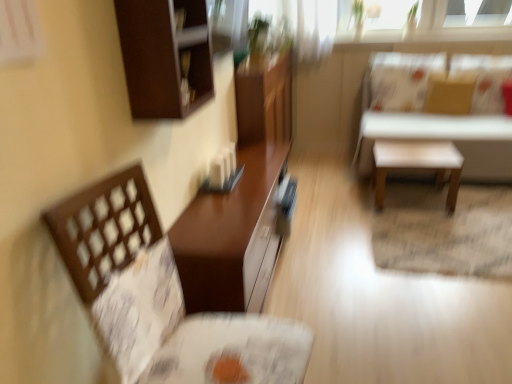
What is the approximate width of white matte stool at upper right, which is the second table from front to back?

white matte stool at upper right, which is the second table from front to back, is 38.55 inches in width.

This screenshot has height=384, width=512. Describe the element at coordinates (445, 139) in the screenshot. I see `white matte stool at upper right, acting as the second table starting from the left` at that location.

Measure the distance between matte brown table at center, placed as the second table when sorted from right to left, and camera.

They are 1.54 meters apart.

Locate an element on the screen. This screenshot has height=384, width=512. brown woven chair at left is located at coordinates (118, 263).

Image resolution: width=512 pixels, height=384 pixels. In order to click on dark brown wood cabinet at upper left in this screenshot , I will do `click(166, 56)`.

Where is `white matte stool at upper right, acting as the second table starting from the left`? This screenshot has height=384, width=512. white matte stool at upper right, acting as the second table starting from the left is located at coordinates (445, 139).

From the image's perspective, which one is positioned lower, brown woven chair at left or white matte stool at upper right, which is the second table from front to back?

brown woven chair at left, from the image's perspective.

At what (x,y) coordinates should I click in order to perform the action: click on chair that appears in front of the white matte stool at upper right, which is the 1th table in right-to-left order. Please return your answer as a coordinate pair (x, y). This screenshot has height=384, width=512. Looking at the image, I should click on (118, 263).

Could you tell me if brown woven chair at left is facing white matte stool at upper right, which is the second table from front to back?

No, brown woven chair at left is not aimed at white matte stool at upper right, which is the second table from front to back.

From a real-world perspective, is white matte stool at center positioned over brown woven chair at left based on gravity?

No.

Which object is further away from the camera, white matte stool at center or brown woven chair at left?

white matte stool at center is behind.

The width and height of the screenshot is (512, 384). In order to click on chair that appears above the white matte stool at center (from a real-world perspective) in this screenshot , I will do `click(118, 263)`.

Which is behind, white matte stool at upper right, which is the 1th table in right-to-left order, or matte brown table at center, the 2th table positioned from the back?

Positioned behind is white matte stool at upper right, which is the 1th table in right-to-left order.

Is white matte stool at upper right, which is the 1th table in right-to-left order, bigger or smaller than matte brown table at center, arranged as the first table when viewed from the front?

Clearly, white matte stool at upper right, which is the 1th table in right-to-left order, is larger in size than matte brown table at center, arranged as the first table when viewed from the front.

From a real-world perspective, between white matte stool at upper right, which is the 1th table in right-to-left order, and matte brown table at center, the 2th table positioned from the back, who is vertically lower?

matte brown table at center, the 2th table positioned from the back, from a real-world perspective.

From the image's perspective, is white matte stool at upper right, which is the 1th table in right-to-left order, located above or below matte brown table at center, which is the first table from left to right?

From the image's perspective, white matte stool at upper right, which is the 1th table in right-to-left order, appears above matte brown table at center, which is the first table from left to right.

Is point (450, 132) closer to camera compared to point (440, 143)?

No, it is behind (440, 143).

Considering the positions of objects white matte stool at upper right, the first table positioned from the back, and white matte stool at center in the image provided, who is behind, white matte stool at upper right, the first table positioned from the back, or white matte stool at center?

Positioned behind is white matte stool at upper right, the first table positioned from the back.

Considering the relative sizes of white matte stool at upper right, the first table positioned from the back, and white matte stool at center in the image provided, is white matte stool at upper right, the first table positioned from the back, smaller than white matte stool at center?

Actually, white matte stool at upper right, the first table positioned from the back, might be larger than white matte stool at center.

Considering the positions of objects white matte stool at upper right, which is the 1th table in right-to-left order, and white matte stool at center in the image provided, who is more to the left, white matte stool at upper right, which is the 1th table in right-to-left order, or white matte stool at center?

Positioned to the left is white matte stool at center.

Are matte brown table at center, which is the first table from left to right, and white matte stool at center beside each other?

No, matte brown table at center, which is the first table from left to right, is not making contact with white matte stool at center.

Can white matte stool at center be found inside matte brown table at center, arranged as the first table when viewed from the front?

Actually, white matte stool at center is outside matte brown table at center, arranged as the first table when viewed from the front.

Between point (185, 233) and point (442, 173), which one is positioned in front?

The point (185, 233) is in front.

In terms of width, does matte brown table at center, which is the first table from left to right, look wider or thinner when compared to white matte stool at center?

Clearly, matte brown table at center, which is the first table from left to right, has less width compared to white matte stool at center.

How many degrees apart are the facing directions of white matte stool at center and white matte stool at upper right, the first table positioned from the back?

1.77 degrees.

From a real-world perspective, which object rests below the other?

white matte stool at center is physically lower.

From their relative heights in the image, would you say white matte stool at center is taller or shorter than white matte stool at upper right, which is the 1th table in right-to-left order?

Considering their sizes, white matte stool at center has less height than white matte stool at upper right, which is the 1th table in right-to-left order.

Can you confirm if white matte stool at center is bigger than white matte stool at upper right, which is the 1th table in right-to-left order?

Actually, white matte stool at center might be smaller than white matte stool at upper right, which is the 1th table in right-to-left order.

Would you say matte brown table at center, which is the first table from left to right, is to the left or to the right of white matte stool at upper right, which is the second table from front to back, in the picture?

matte brown table at center, which is the first table from left to right, is positioned on white matte stool at upper right, which is the second table from front to back,'s left side.

Considering the relative sizes of matte brown table at center, the 2th table positioned from the back, and white matte stool at upper right, acting as the second table starting from the left, in the image provided, is matte brown table at center, the 2th table positioned from the back, shorter than white matte stool at upper right, acting as the second table starting from the left,?

Yes, matte brown table at center, the 2th table positioned from the back, is shorter than white matte stool at upper right, acting as the second table starting from the left.

Is the depth of matte brown table at center, arranged as the first table when viewed from the front, less than that of white matte stool at upper right, which is the 1th table in right-to-left order?

Yes, the depth of matte brown table at center, arranged as the first table when viewed from the front, is less than that of white matte stool at upper right, which is the 1th table in right-to-left order.

The width and height of the screenshot is (512, 384). There is a brown woven chair at left. In order to click on the 2nd table above it (from the image's perspective) in this screenshot , I will do `click(445, 139)`.

The width and height of the screenshot is (512, 384). In order to click on side table located on the right of brown woven chair at left in this screenshot , I will do `click(417, 164)`.

Estimate the real-world distances between objects in this image. Which object is further from white matte stool at center, matte brown table at center, placed as the second table when sorted from right to left, or brown woven chair at left?

Based on the image, brown woven chair at left appears to be further to white matte stool at center.

Looking at the image, which one is located closer to dark brown wood cabinet at upper left, white matte stool at center or white matte stool at upper right, which is the 1th table in right-to-left order?

white matte stool at center.

Looking at the image, which one is located closer to brown woven chair at left, matte brown table at center, which is the first table from left to right, or dark brown wood cabinet at upper left?

Among the two, matte brown table at center, which is the first table from left to right, is located nearer to brown woven chair at left.

Looking at the image, which one is located further to white matte stool at center, brown woven chair at left or dark brown wood cabinet at upper left?

brown woven chair at left.

Which object lies further to the anchor point matte brown table at center, arranged as the first table when viewed from the front, brown woven chair at left or white matte stool at center?

white matte stool at center lies further to matte brown table at center, arranged as the first table when viewed from the front, than the other object.

When comparing their distances from white matte stool at upper right, which is the second table from front to back, does brown woven chair at left or white matte stool at center seem closer?

white matte stool at center is positioned closer to the anchor white matte stool at upper right, which is the second table from front to back.

Considering their positions, is white matte stool at upper right, acting as the second table starting from the left, positioned further to dark brown wood cabinet at upper left than brown woven chair at left?

white matte stool at upper right, acting as the second table starting from the left, is further to dark brown wood cabinet at upper left.

Estimate the real-world distances between objects in this image. Which object is closer to white matte stool at center, brown woven chair at left or white matte stool at upper right, acting as the second table starting from the left?

Based on the image, white matte stool at upper right, acting as the second table starting from the left, appears to be nearer to white matte stool at center.

At what (x,y) coordinates should I click in order to perform the action: click on table between dark brown wood cabinet at upper left and white matte stool at center in the front-back direction. Please return your answer as a coordinate pair (x, y). This screenshot has width=512, height=384. Looking at the image, I should click on (228, 234).

You are a GUI agent. You are given a task and a screenshot of the screen. Output one action in this format:
    pyautogui.click(x=<x>, y=<y>)
    Task: Click on the side table located between brown woven chair at left and white matte stool at upper right, the first table positioned from the back, in the depth direction
    
    Given the screenshot: What is the action you would take?
    pyautogui.click(x=417, y=164)

Locate an element on the screen. side table between matte brown table at center, which is the first table from left to right, and white matte stool at upper right, the first table positioned from the back is located at coordinates (417, 164).

The image size is (512, 384). In order to click on side table between dark brown wood cabinet at upper left and white matte stool at upper right, acting as the second table starting from the left in this screenshot , I will do `click(417, 164)`.